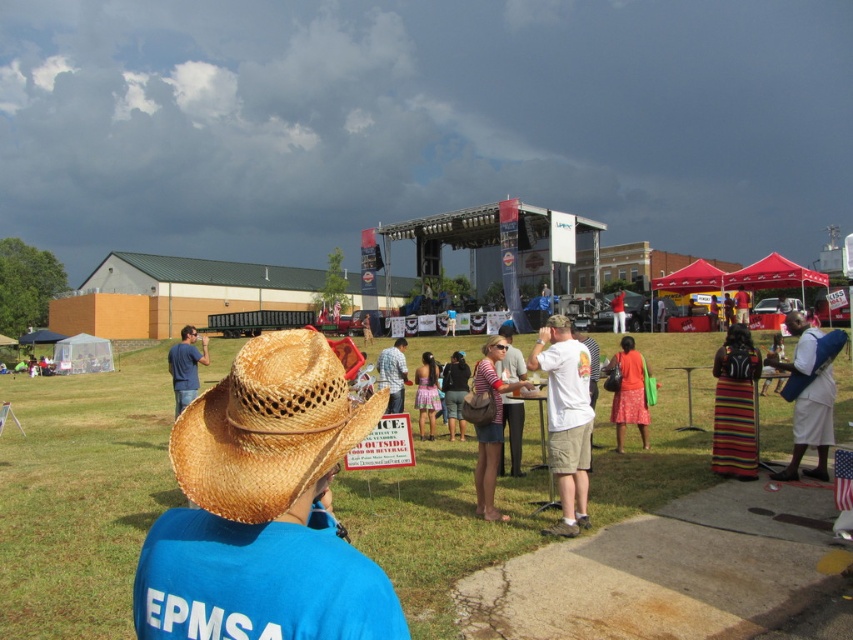
You are attending an outdoor event and notice two attendees wearing the striped fabric dress at lower right and the blue denim jeans at left. Which clothing item appears shorter in the image?

The striped fabric dress at lower right has a lesser height compared to the blue denim jeans at left, so the striped fabric dress at lower right appears shorter.

You are standing at point (525, 387) and want to walk towards point (817, 476). Given that there are no obstacles between these two points, will you be able to see the person in the blue shirt with EPMSA printed on the back throughout your walk?

Since point (817, 476) is behind point (525, 387), the person in the blue shirt with EPMSA printed on the back would be in front of your path. As you walk towards the second point, the person might block your view or become obscured depending on their position relative to your path. However, according to the spatial description, the two points indicate that the destination is behind your starting point, meaning you would be moving away from the person, so you should remain visible as long as there are

You are organizing a community event and need to place a matte brown cowboy hat at center and a dark gray fabric backpack at center on a table. Which object should you place first if you want to ensure both items fit without overlapping?

The matte brown cowboy hat at center has a smaller size compared to the dark gray fabric backpack at center, so you should place the dark gray fabric backpack at center first to accommodate its larger size before placing the smaller matte brown cowboy hat at center.